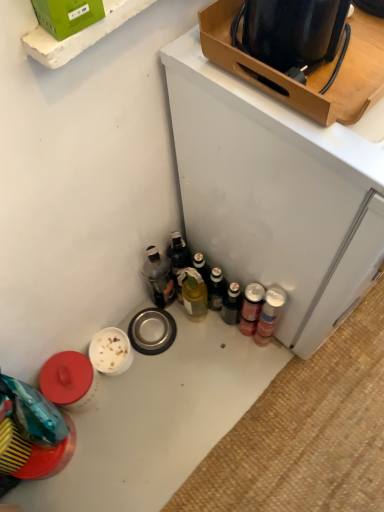
I want to click on vacant area located to the right-hand side of metallic silver can at lower right, the 4th bottle in the left-to-right sequence, so click(323, 358).